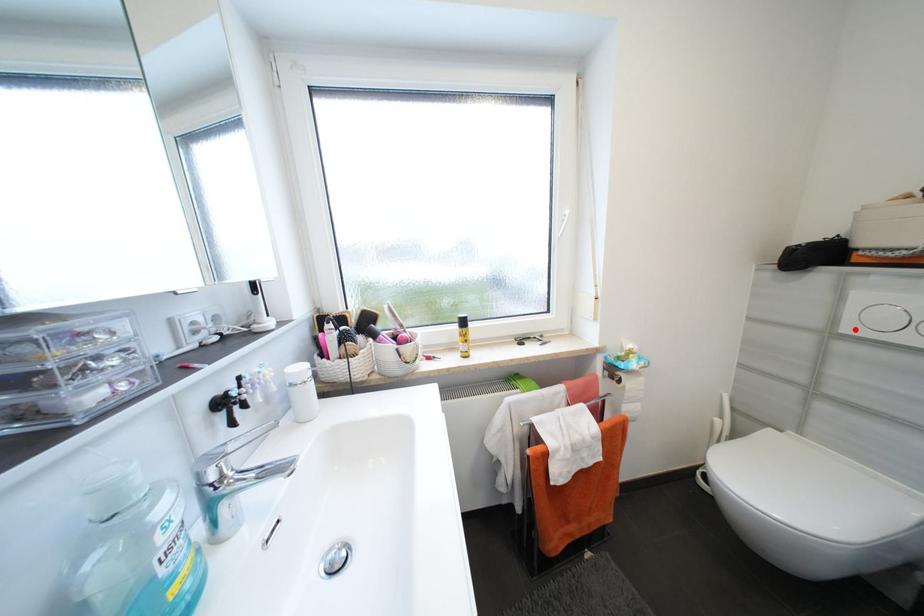
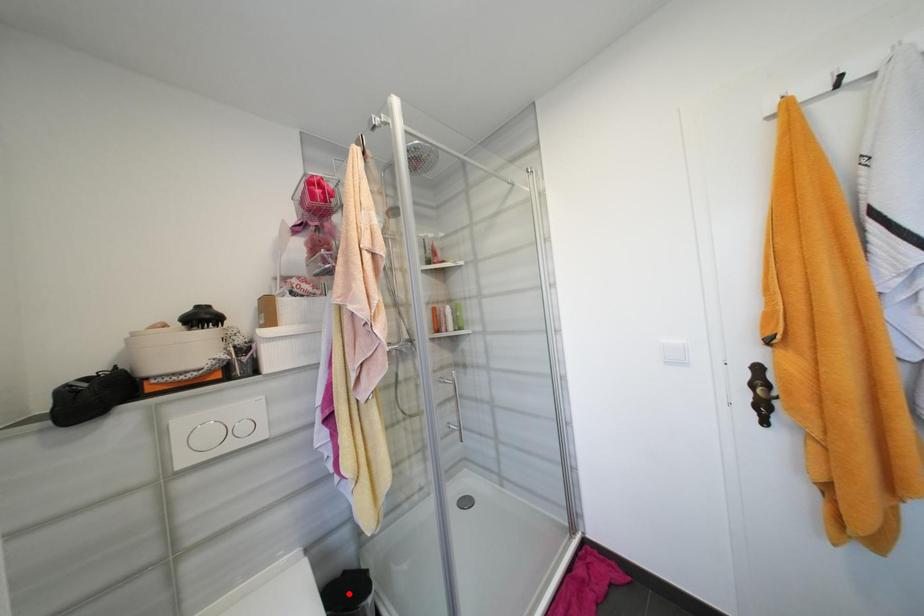
I am providing you with two images of the same scene from different viewpoints. A red point is marked on the first image and another point is marked on the second image. Is the marked point in image1 the same physical position as the marked point in image2?

No